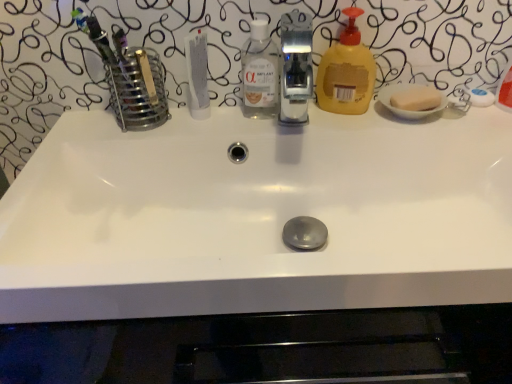
Question: Is white matte tube at center located outside yellow translucent liquid soap at right?

Choices:
 (A) yes
 (B) no

Answer: (A)

Question: Considering the relative sizes of white matte tube at center and yellow translucent liquid soap at right in the image provided, is white matte tube at center taller than yellow translucent liquid soap at right?

Choices:
 (A) yes
 (B) no

Answer: (B)

Question: Considering the relative sizes of white matte tube at center and yellow translucent liquid soap at right in the image provided, is white matte tube at center wider than yellow translucent liquid soap at right?

Choices:
 (A) no
 (B) yes

Answer: (A)

Question: Is white matte tube at center placed right next to yellow translucent liquid soap at right?

Choices:
 (A) no
 (B) yes

Answer: (A)

Question: Is white matte tube at center positioned far away from yellow translucent liquid soap at right?

Choices:
 (A) yes
 (B) no

Answer: (B)

Question: Is white matte tube at center turned away from yellow translucent liquid soap at right?

Choices:
 (A) yes
 (B) no

Answer: (B)

Question: Does transparent plastic bottle at center appear on the left side of satin nickel faucet at center?

Choices:
 (A) yes
 (B) no

Answer: (A)

Question: Is transparent plastic bottle at center positioned far away from satin nickel faucet at center?

Choices:
 (A) no
 (B) yes

Answer: (B)

Question: From a real-world perspective, does transparent plastic bottle at center sit lower than satin nickel faucet at center?

Choices:
 (A) yes
 (B) no

Answer: (A)

Question: Can you confirm if transparent plastic bottle at center is bigger than satin nickel faucet at center?

Choices:
 (A) no
 (B) yes

Answer: (A)

Question: From a real-world perspective, is transparent plastic bottle at center on satin nickel faucet at center?

Choices:
 (A) no
 (B) yes

Answer: (A)

Question: Is transparent plastic bottle at center with satin nickel faucet at center?

Choices:
 (A) yes
 (B) no

Answer: (B)

Question: Is yellow translucent liquid soap at right surrounding satin nickel faucet at center?

Choices:
 (A) no
 (B) yes

Answer: (A)